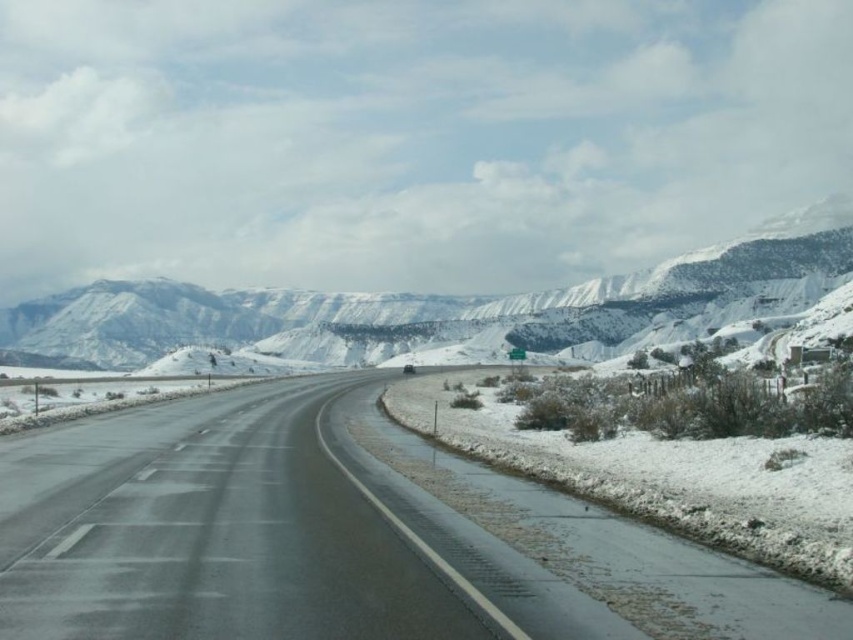
Who is lower down, black asphalt highway at center or snowy rocky mountain at upper center?

black asphalt highway at center is lower down.

Measure the distance between black asphalt highway at center and camera.

black asphalt highway at center and camera are 6.93 meters apart.

In order to click on black asphalt highway at center in this screenshot , I will do `click(340, 536)`.